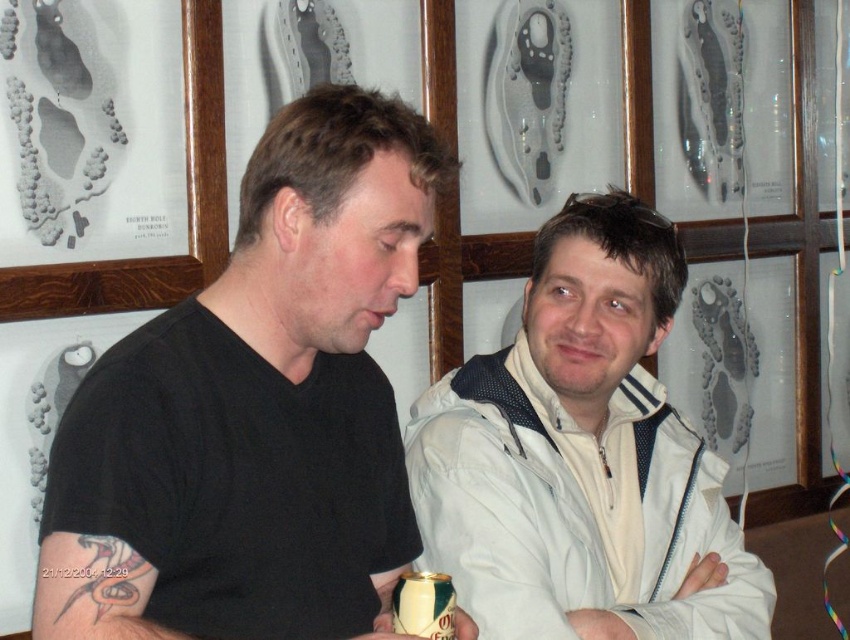
Question: Which of the following is the closest to the observer?

Choices:
 (A) black matte shirt at center
 (B) white matte jacket at center

Answer: (A)

Question: Can you confirm if white matte jacket at center is positioned to the left of green matte can at lower center?

Choices:
 (A) no
 (B) yes

Answer: (A)

Question: Estimate the real-world distances between objects in this image. Which object is closer to the green matte can at lower center?

Choices:
 (A) black matte shirt at center
 (B) white matte jacket at center

Answer: (A)

Question: Can you confirm if black matte shirt at center is positioned to the right of green matte can at lower center?

Choices:
 (A) no
 (B) yes

Answer: (A)

Question: Which of the following is the farthest from the observer?

Choices:
 (A) (518, 616)
 (B) (350, 547)
 (C) (432, 584)

Answer: (A)

Question: Is black matte shirt at center smaller than white matte jacket at center?

Choices:
 (A) no
 (B) yes

Answer: (B)